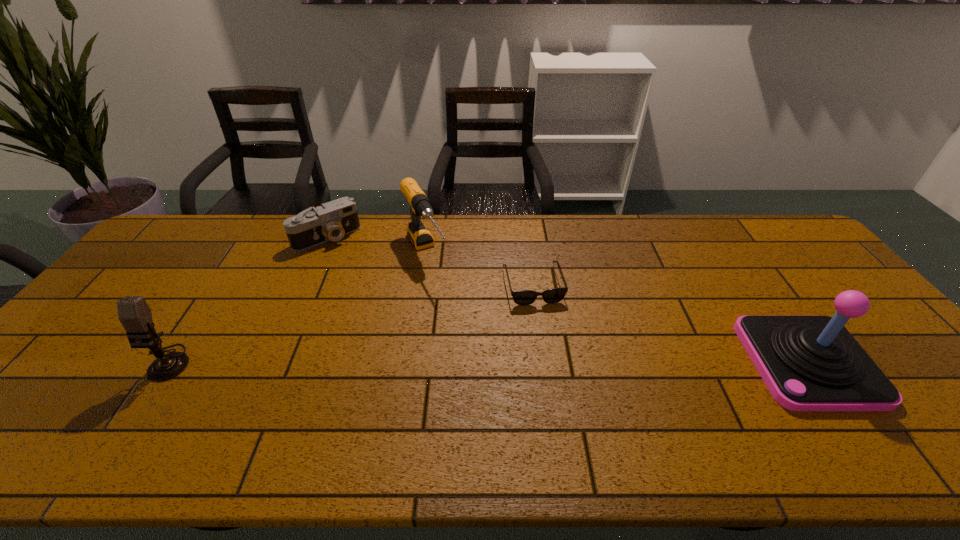
Where is `vacant space that is in between the rightmost object and the fourth object from right to left`? This screenshot has height=540, width=960. vacant space that is in between the rightmost object and the fourth object from right to left is located at coordinates (567, 300).

I want to click on the closest object to the drill, so click(333, 220).

The height and width of the screenshot is (540, 960). What are the coordinates of `the second closest object to the third object from right to left` in the screenshot? It's located at (522, 297).

At what (x,y) coordinates should I click in order to perform the action: click on free space that satisfies the following two spatial constraints: 1. on the front-facing side of the microphone; 2. forward from the base of the joystick. Please return your answer as a coordinate pair (x, y). Looking at the image, I should click on (166, 362).

Find the location of a particular element. Image resolution: width=960 pixels, height=540 pixels. vacant region that satisfies the following two spatial constraints: 1. on the front side of the second shortest object; 2. forward from the base of the joystick is located at coordinates (272, 362).

In order to click on free space that satisfies the following two spatial constraints: 1. on the front-facing side of the leftmost object; 2. forward from the base of the rightmost object in this screenshot , I will do `click(166, 362)`.

Where is `free space that satisfies the following two spatial constraints: 1. on the front side of the sunglasses; 2. on the left side of the drill`? free space that satisfies the following two spatial constraints: 1. on the front side of the sunglasses; 2. on the left side of the drill is located at coordinates (420, 285).